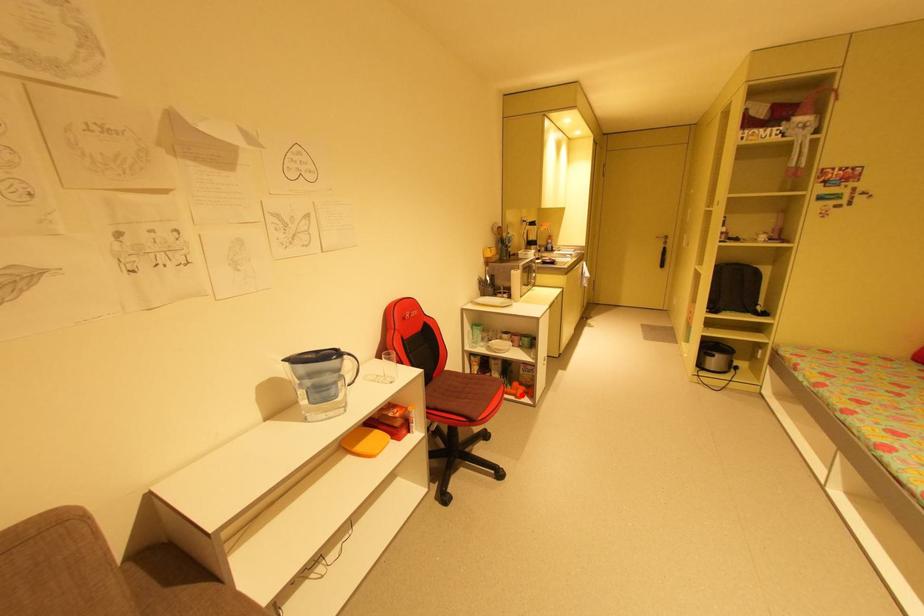
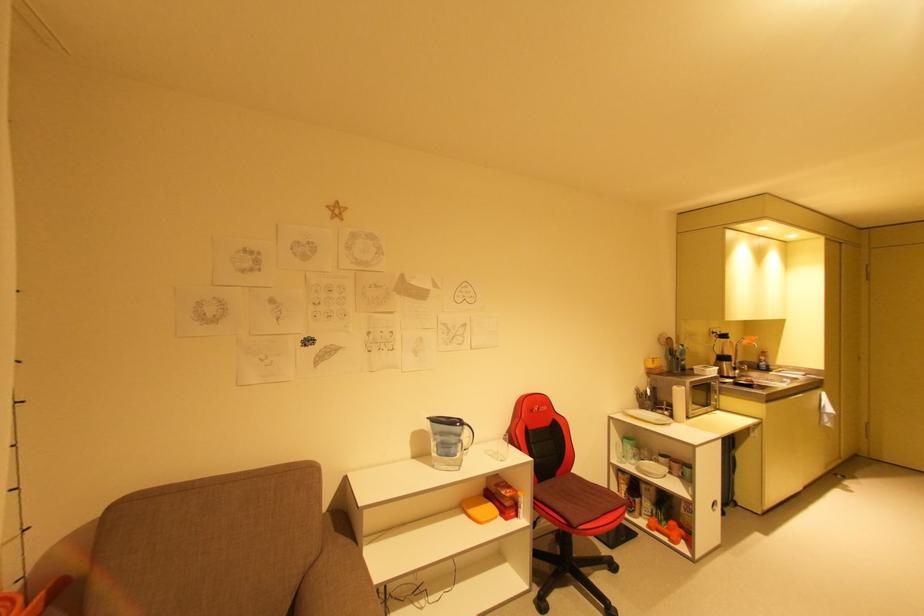
Locate, in the second image, the point that corresponds to the highlighted location in the first image.

(675, 538)